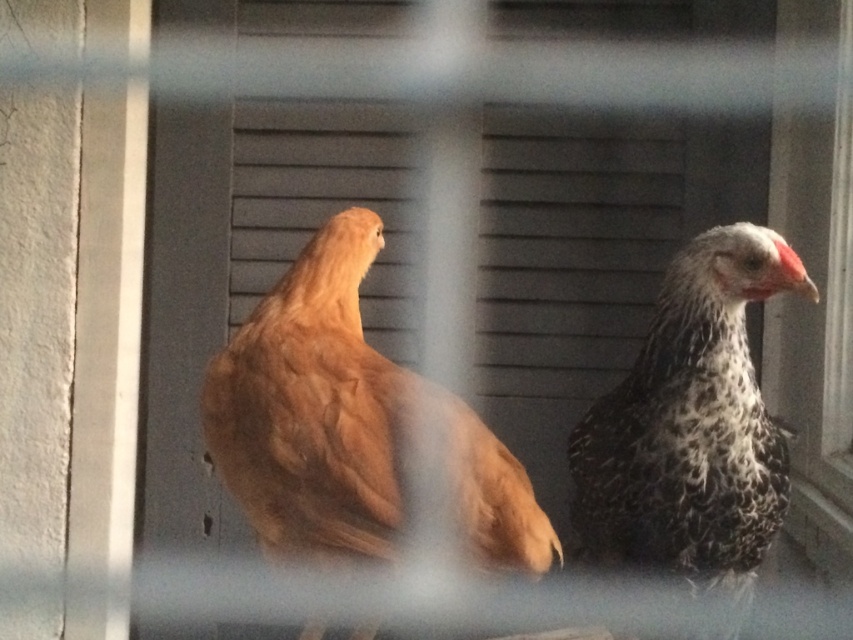
Looking at this image, you are standing in front of a chicken coop with a wire mesh barrier. You see two points marked on the mesh at coordinates point (241,330) and point (704,420). If you want to place a sticker on the mesh closer to you, which point should you choose?

You should choose point (241,330) because it is closer to you than point (704,420).

You are a farmer checking the coop and notice the golden feathered chicken at center and the speckled feathered chicken at right. Which chicken is wider?

The golden feathered chicken at center is wider than the speckled feathered chicken at right.

You are a farmer who wants to build a chicken coop with a height requirement of 40 cm. You observe the golden feathered chicken at center and the speckled feathered chicken at right in the image. Which chicken requires a taller space to accommodate its height?

The golden feathered chicken at center requires a taller space because it has a greater height compared to the speckled feathered chicken at right.